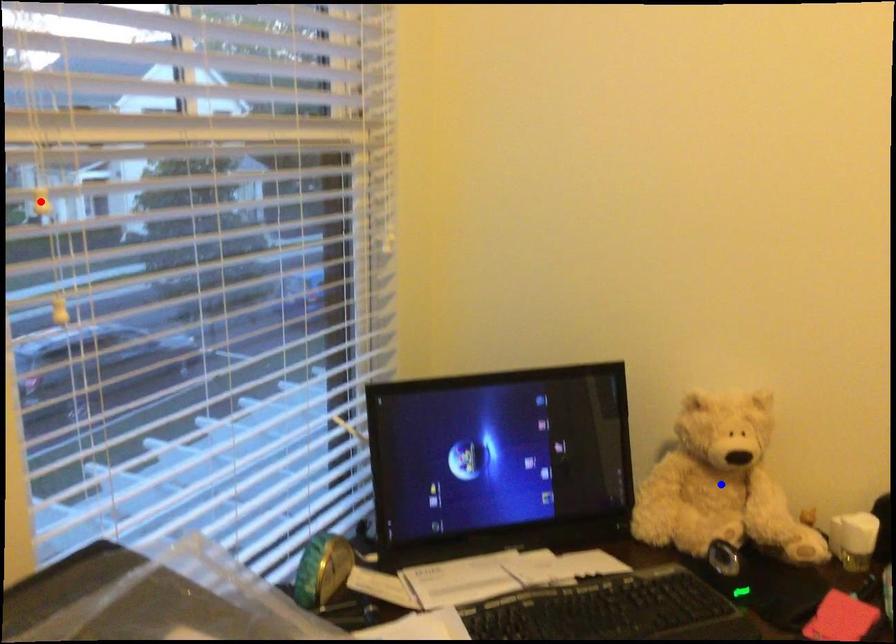
Question: Which of the two points in the image is closer to the camera?

Choices:
 (A) Blue point is closer.
 (B) Red point is closer.

Answer: (B)